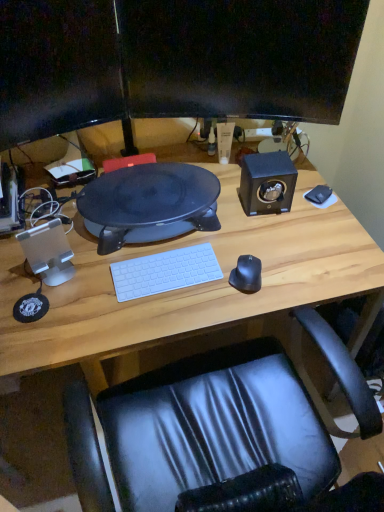
Locate an element on the screen. The width and height of the screenshot is (384, 512). vacant area that lies between white matte keyboard at center and black matte mousepad at right is located at coordinates (240, 236).